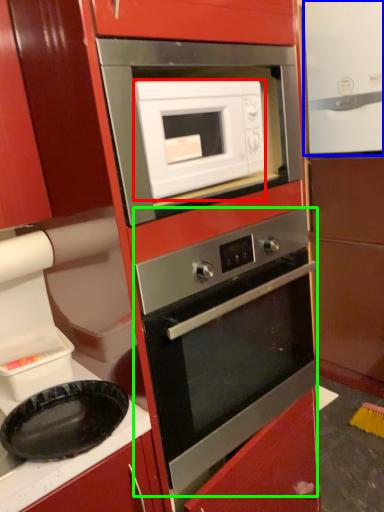
Question: Based on their relative distances, which object is nearer to microwave oven (highlighted by a red box)? Choose from appliance (highlighted by a blue box) and oven (highlighted by a green box).

Choices:
 (A) appliance
 (B) oven

Answer: (B)